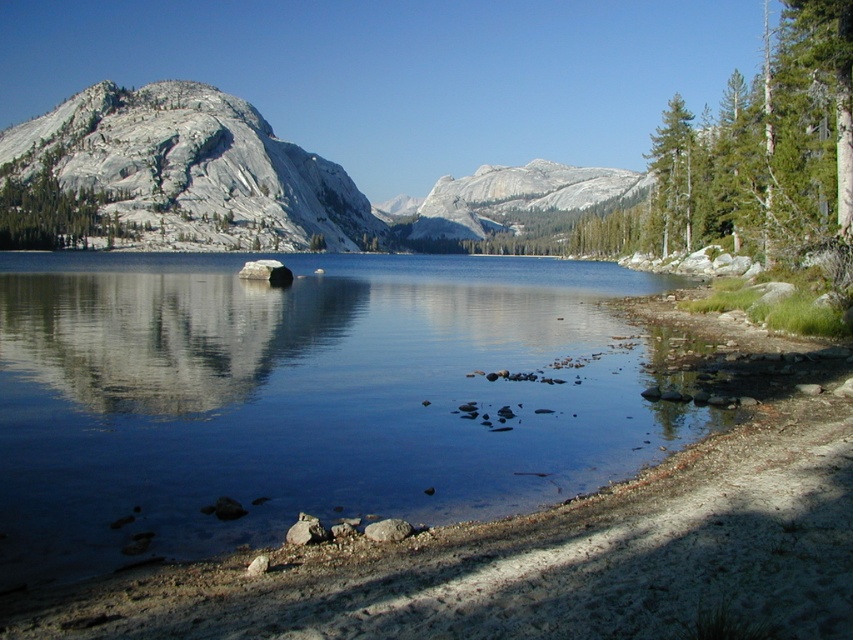
Question: Does green textured tree at right appear on the left side of green textured pine tree at right?

Choices:
 (A) yes
 (B) no

Answer: (B)

Question: Which point is farther to the camera?

Choices:
 (A) granite mountain at upper left
 (B) smooth water at lower left
 (C) granite mountain at center

Answer: (C)

Question: Where is green textured tree at right located in relation to green textured pine tree at right in the image?

Choices:
 (A) left
 (B) right

Answer: (B)

Question: Which of the following is the closest to the observer?

Choices:
 (A) green textured pine tree at right
 (B) green textured tree at right

Answer: (B)

Question: Observing the image, what is the correct spatial positioning of smooth gray rock at upper left in reference to green textured pine tree at right?

Choices:
 (A) below
 (B) above

Answer: (A)

Question: Which object is positioned farthest from the granite mountain at center?

Choices:
 (A) smooth water at lower left
 (B) smooth gray rock at upper left

Answer: (A)